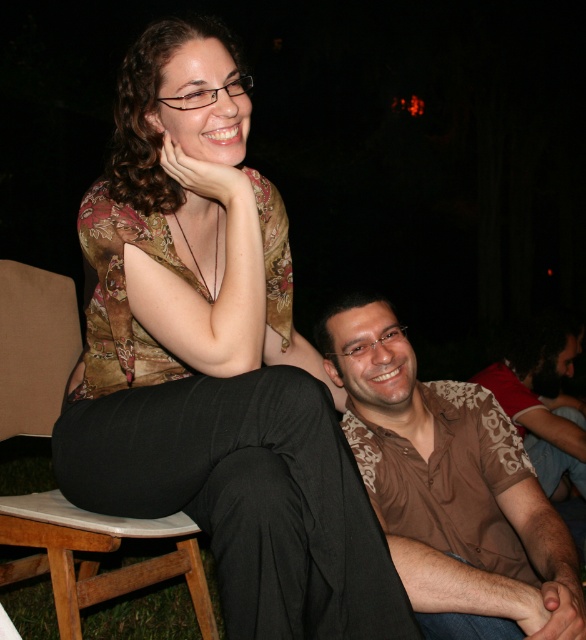
Question: Which point is farther to the camera?

Choices:
 (A) (151, 449)
 (B) (483, 538)
 (C) (69, 570)
 (D) (577, 477)

Answer: (D)

Question: Can you confirm if wooden at left is positioned above brown patterned shirt at lower right?

Choices:
 (A) no
 (B) yes

Answer: (A)

Question: From the image, what is the correct spatial relationship of brown printed shirt at center in relation to wooden at left?

Choices:
 (A) below
 (B) above

Answer: (B)

Question: Is wooden at left positioned in front of brown patterned shirt at lower right?

Choices:
 (A) yes
 (B) no

Answer: (A)

Question: Which object is positioned closest to the floral-patterned blouse at upper center?

Choices:
 (A) brown patterned shirt at lower right
 (B) wooden at left

Answer: (B)

Question: Among these objects, which one is farthest from the camera?

Choices:
 (A) brown patterned shirt at lower right
 (B) wooden at left

Answer: (A)